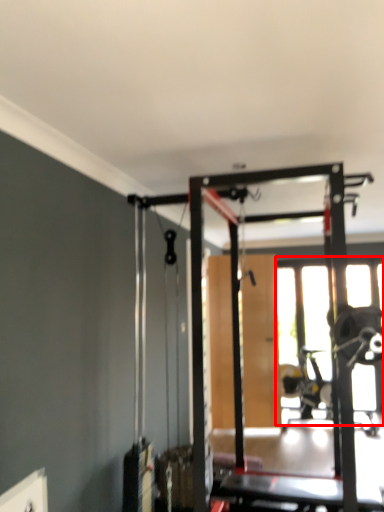
Question: From the image's perspective, where is window (annotated by the red box) located in relation to screen door in the image?

Choices:
 (A) above
 (B) below

Answer: (B)